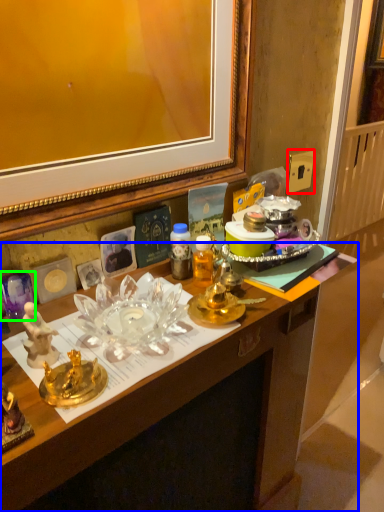
Question: Based on their relative distances, which object is nearer to power outlet (highlighted by a red box)? Choose from desk (highlighted by a blue box) and plate (highlighted by a green box).

Choices:
 (A) desk
 (B) plate

Answer: (A)